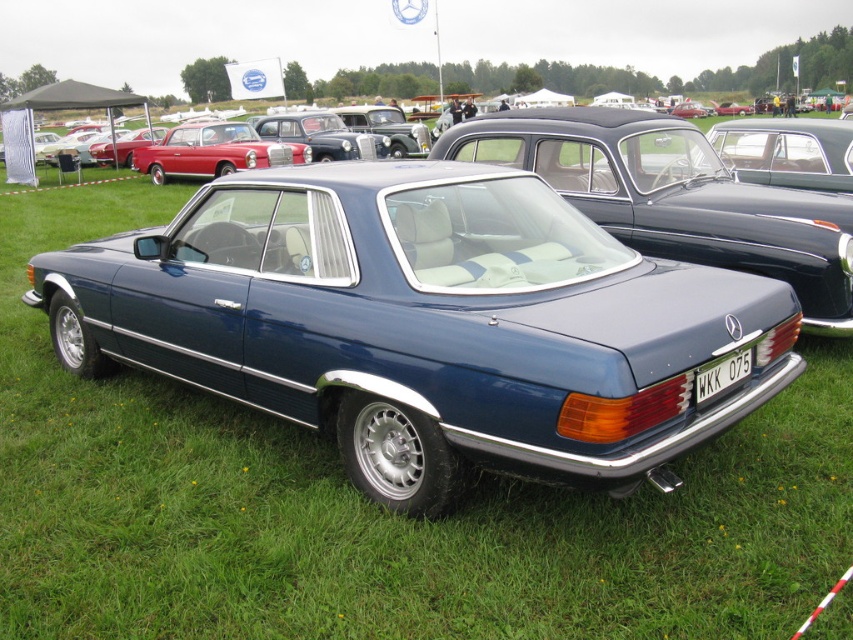
Who is more distant from viewer, (808,241) or (163,145)?

The point (163,145) is more distant.

Identify the location of satin blue car at center. This screenshot has width=853, height=640. (674, 196).

Who is more forward, (x=558, y=176) or (x=730, y=372)?

Point (x=730, y=372) is in front.

Can you confirm if satin blue car at center is bigger than white plastic license plate at center?

Correct, satin blue car at center is larger in size than white plastic license plate at center.

Describe the element at coordinates (674, 196) in the screenshot. The height and width of the screenshot is (640, 853). I see `satin blue car at center` at that location.

Where is `satin blue car at center`? satin blue car at center is located at coordinates (674, 196).

Which is in front, point (244, 140) or point (712, 392)?

Positioned in front is point (712, 392).

Which of these two, shiny red car at upper left or white plastic license plate at center, stands taller?

shiny red car at upper left is taller.

Between point (308, 156) and point (720, 369), which one is positioned behind?

Positioned behind is point (308, 156).

I want to click on shiny red car at upper left, so click(x=213, y=150).